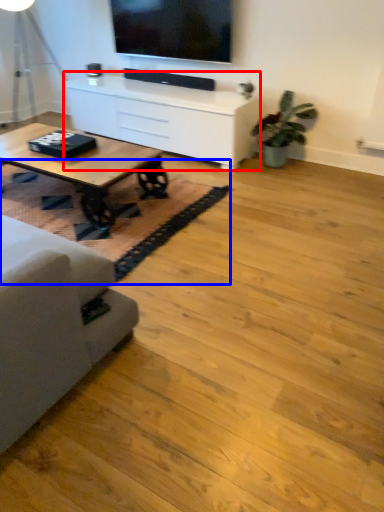
Question: Which of the following is the farthest to the observer, table (highlighted by a red box) or mat (highlighted by a blue box)?

Choices:
 (A) table
 (B) mat

Answer: (A)